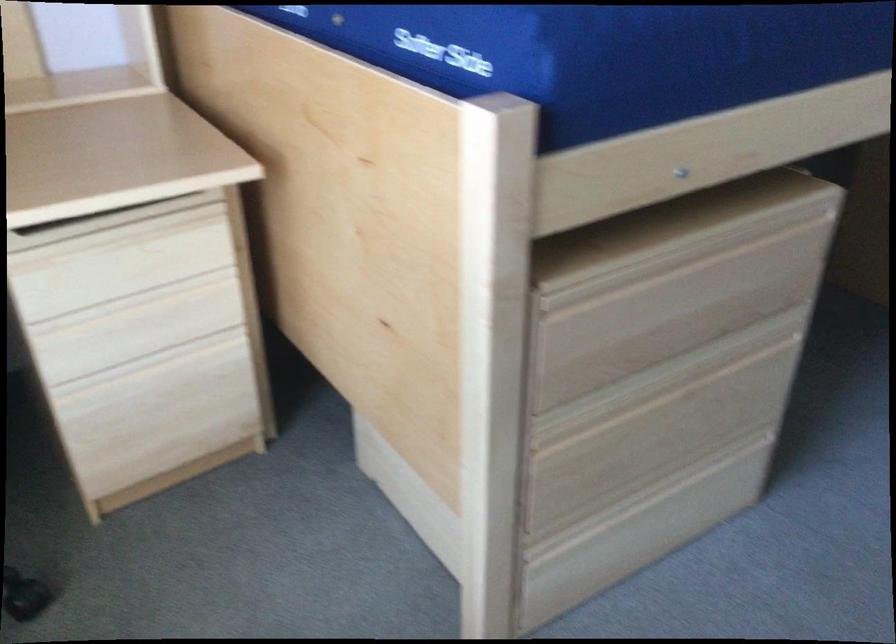
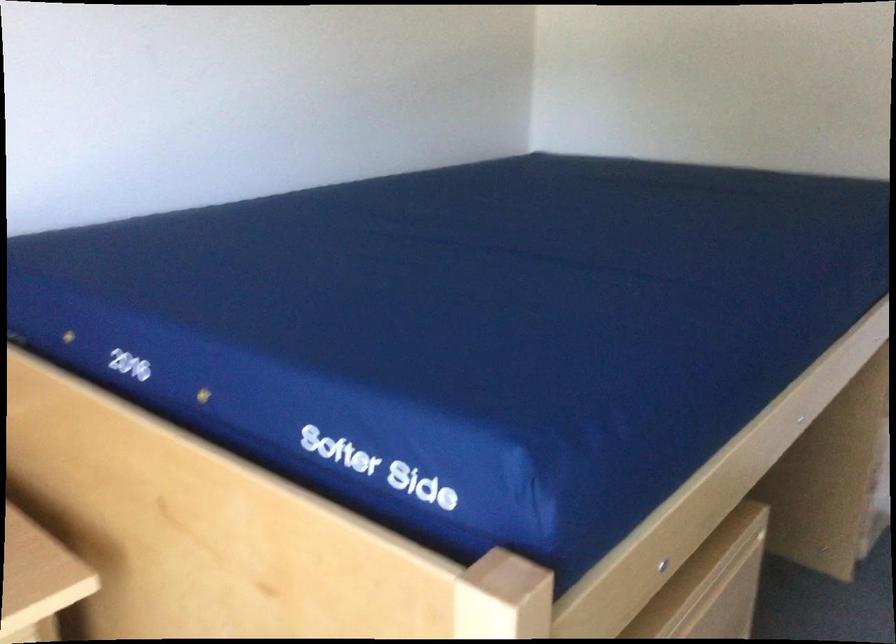
Question: How did the camera likely rotate?

Choices:
 (A) Left
 (B) Right
 (C) Up
 (D) Down

Answer: (B)